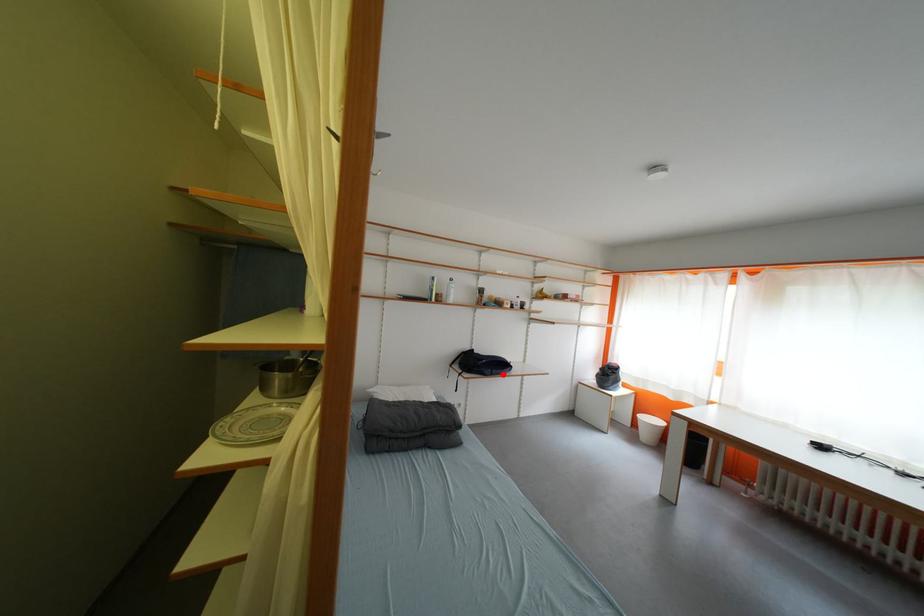
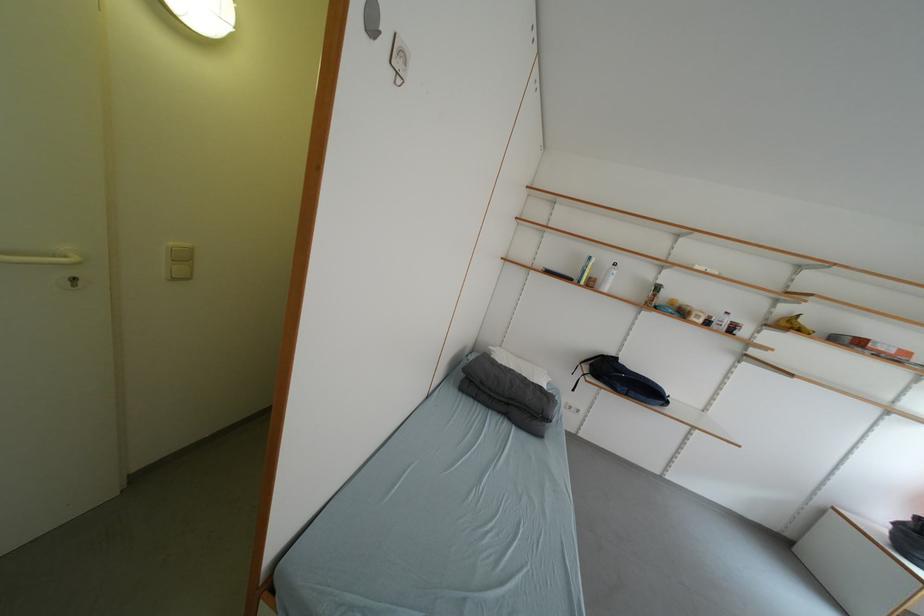
Find the pixel in the second image that matches the highlighted location in the first image.

(640, 395)